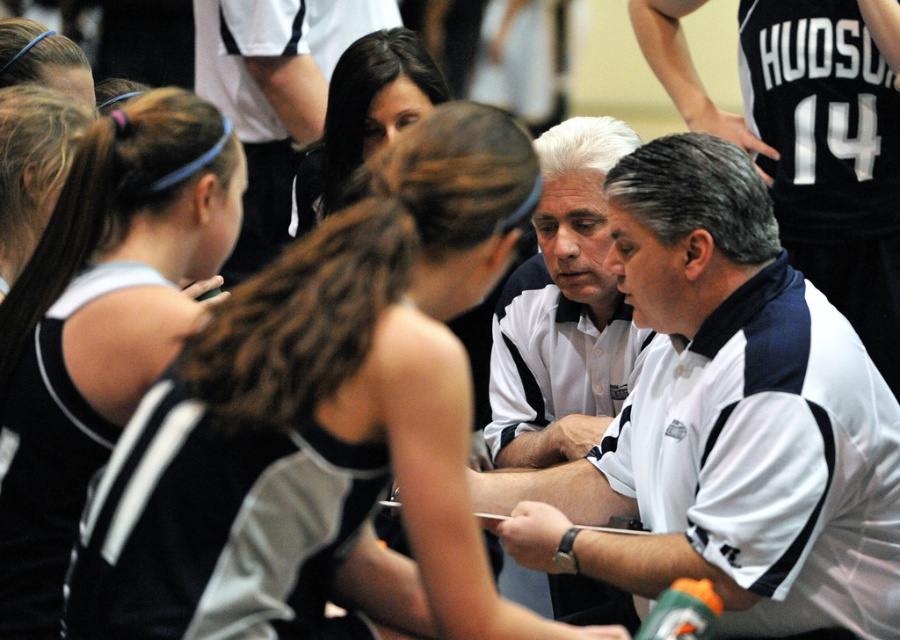
Question: From the image, what is the correct spatial relationship of white/blue polo shirt at center in relation to black jersey at left?

Choices:
 (A) below
 (B) above

Answer: (A)

Question: Which point is farther to the camera?

Choices:
 (A) smooth brown hair at center
 (B) white polo shirt at center
 (C) white/blue polo shirt at center
 (D) black jersey at left

Answer: (A)

Question: Is white polo shirt at center to the right of smooth brown hair at center from the viewer's perspective?

Choices:
 (A) no
 (B) yes

Answer: (B)

Question: Which object is positioned farthest from the white/blue polo shirt at center?

Choices:
 (A) white polo shirt at center
 (B) smooth brown hair at center

Answer: (B)

Question: Is black jersey at left to the left of white polo shirt at center from the viewer's perspective?

Choices:
 (A) yes
 (B) no

Answer: (A)

Question: Which object appears farthest from the camera in this image?

Choices:
 (A) white polo shirt at center
 (B) black jersey at left
 (C) smooth brown hair at center

Answer: (C)